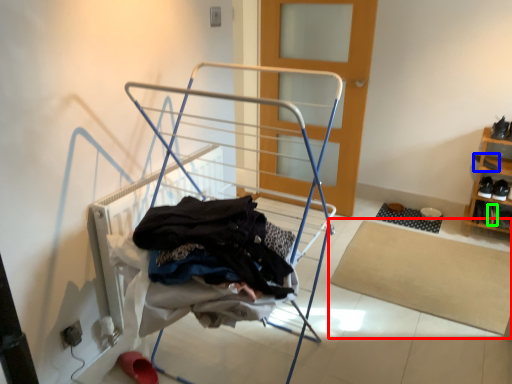
Question: Based on their relative distances, which object is nearer to mat (highlighted by a red box)? Choose from shoe (highlighted by a blue box) and shoe (highlighted by a green box).

Choices:
 (A) shoe
 (B) shoe

Answer: (B)